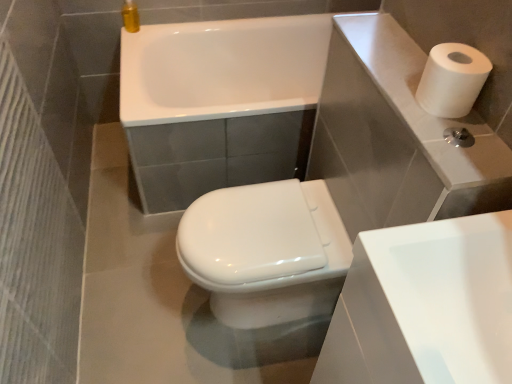
Locate an element on the screen. The height and width of the screenshot is (384, 512). unoccupied space behind white matte paper towel at upper right is located at coordinates (393, 59).